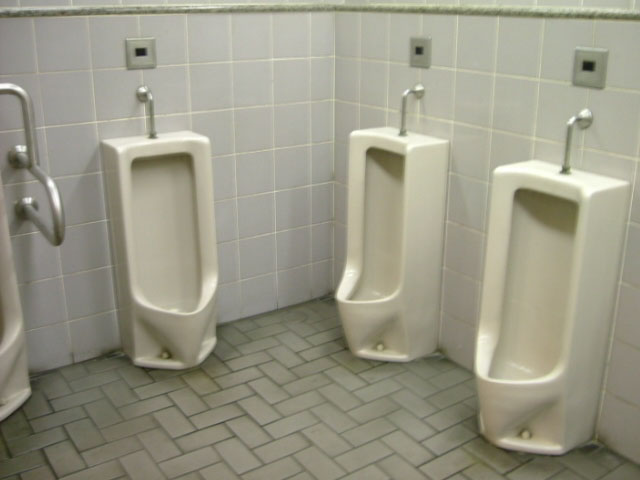
At what (x,y) coordinates should I click in order to perform the action: click on urinal. Please return your answer as a coordinate pair (x, y). The height and width of the screenshot is (480, 640). Looking at the image, I should click on (6, 321), (161, 266), (402, 233), (529, 301).